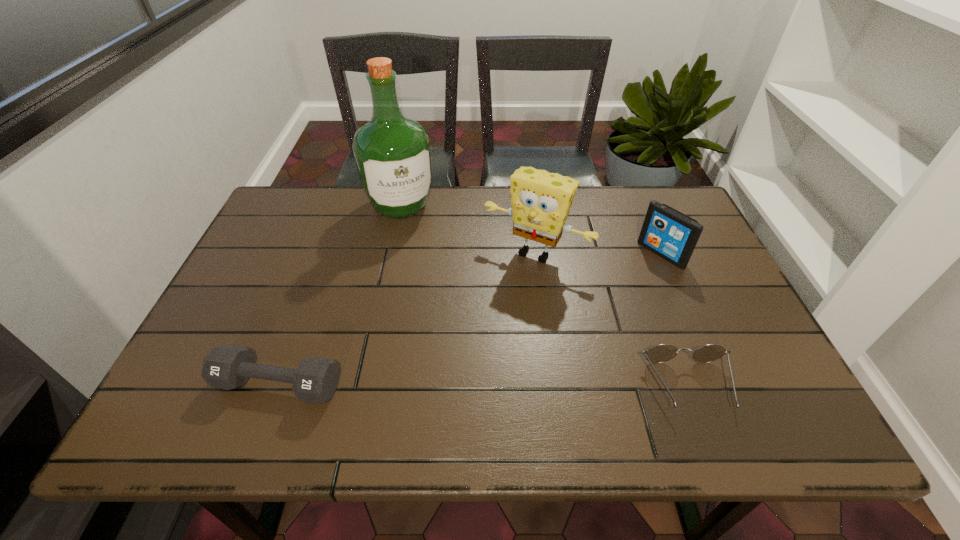
Identify the location of free region located 0.180m on the face of the third object from right to left. Image resolution: width=960 pixels, height=540 pixels. (483, 317).

Find the location of a particular element. Image resolution: width=960 pixels, height=540 pixels. vacant space located on the front-facing side of the farthest object is located at coordinates (415, 238).

Locate an element on the screen. Image resolution: width=960 pixels, height=540 pixels. free point located on the front-facing side of the farthest object is located at coordinates (447, 312).

I want to click on vacant space located on the front-facing side of the farthest object, so tap(419, 246).

At what (x,y) coordinates should I click in order to perform the action: click on vacant space situated on the front screen of the iPod. Please return your answer as a coordinate pair (x, y). This screenshot has height=540, width=960. Looking at the image, I should click on (623, 284).

In order to click on vacant area situated 0.160m on the front screen of the iPod in this screenshot , I will do tap(613, 292).

Identify the location of vacant space located on the front screen of the iPod. (628, 281).

Identify the location of object that is at the far edge. The width and height of the screenshot is (960, 540). (392, 153).

The width and height of the screenshot is (960, 540). In order to click on dumbbell present at the near edge in this screenshot , I will do `click(315, 380)`.

The width and height of the screenshot is (960, 540). Identify the location of spectacles that is at the near edge. (660, 353).